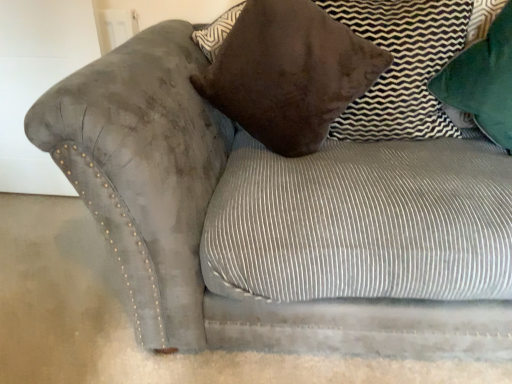
Question: Is brown suede pillow at upper right, which is counted as the 2th pillow, starting from the left, to the left of velvet brown pillow at upper center, marked as the first pillow in a left-to-right arrangement, from the viewer's perspective?

Choices:
 (A) yes
 (B) no

Answer: (B)

Question: From the image's perspective, is brown suede pillow at upper right, acting as the 2th pillow starting from the right, under velvet brown pillow at upper center, which is counted as the 3th pillow, starting from the right?

Choices:
 (A) yes
 (B) no

Answer: (B)

Question: Does brown suede pillow at upper right, which is counted as the 2th pillow, starting from the left, come in front of velvet brown pillow at upper center, marked as the first pillow in a left-to-right arrangement?

Choices:
 (A) yes
 (B) no

Answer: (B)

Question: Is velvet brown pillow at upper center, marked as the first pillow in a left-to-right arrangement, at the back of brown suede pillow at upper right, which is counted as the 2th pillow, starting from the left?

Choices:
 (A) yes
 (B) no

Answer: (A)

Question: Is brown suede pillow at upper right, which is counted as the 2th pillow, starting from the left, at the right side of velvet brown pillow at upper center, which is counted as the 3th pillow, starting from the right?

Choices:
 (A) no
 (B) yes

Answer: (B)

Question: Considering the relative sizes of brown suede pillow at upper right, acting as the 2th pillow starting from the right, and velvet brown pillow at upper center, which is counted as the 3th pillow, starting from the right, in the image provided, is brown suede pillow at upper right, acting as the 2th pillow starting from the right, shorter than velvet brown pillow at upper center, which is counted as the 3th pillow, starting from the right,?

Choices:
 (A) no
 (B) yes

Answer: (B)

Question: Is the depth of green velvet pillow at upper right, which ranks as the 3th pillow in left-to-right order, less than that of velvet brown pillow at upper center, which is counted as the 3th pillow, starting from the right?

Choices:
 (A) no
 (B) yes

Answer: (A)

Question: From a real-world perspective, is green velvet pillow at upper right, arranged as the first pillow when viewed from the right, over velvet brown pillow at upper center, marked as the first pillow in a left-to-right arrangement?

Choices:
 (A) yes
 (B) no

Answer: (A)

Question: Is velvet brown pillow at upper center, which is counted as the 3th pillow, starting from the right, at the back of green velvet pillow at upper right, which ranks as the 3th pillow in left-to-right order?

Choices:
 (A) no
 (B) yes

Answer: (A)

Question: Is green velvet pillow at upper right, arranged as the first pillow when viewed from the right, far from velvet brown pillow at upper center, which is counted as the 3th pillow, starting from the right?

Choices:
 (A) no
 (B) yes

Answer: (A)

Question: Is green velvet pillow at upper right, arranged as the first pillow when viewed from the right, aimed at velvet brown pillow at upper center, which is counted as the 3th pillow, starting from the right?

Choices:
 (A) no
 (B) yes

Answer: (A)

Question: Is green velvet pillow at upper right, which ranks as the 3th pillow in left-to-right order, surrounding velvet brown pillow at upper center, which is counted as the 3th pillow, starting from the right?

Choices:
 (A) yes
 (B) no

Answer: (B)

Question: From a real-world perspective, is green velvet pillow at upper right, which ranks as the 3th pillow in left-to-right order, on brown suede pillow at upper right, which is counted as the 2th pillow, starting from the left?

Choices:
 (A) no
 (B) yes

Answer: (B)